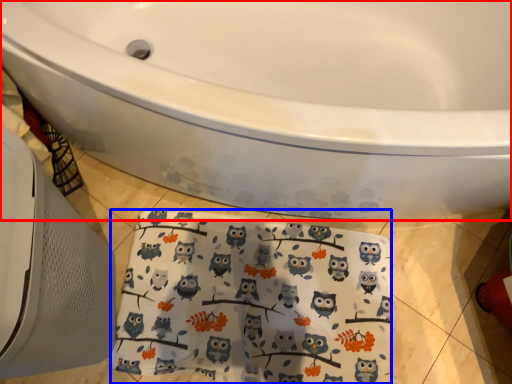
Question: Which of the following is the closest to the observer, bathtub (highlighted by a red box) or beach towel (highlighted by a blue box)?

Choices:
 (A) bathtub
 (B) beach towel

Answer: (A)